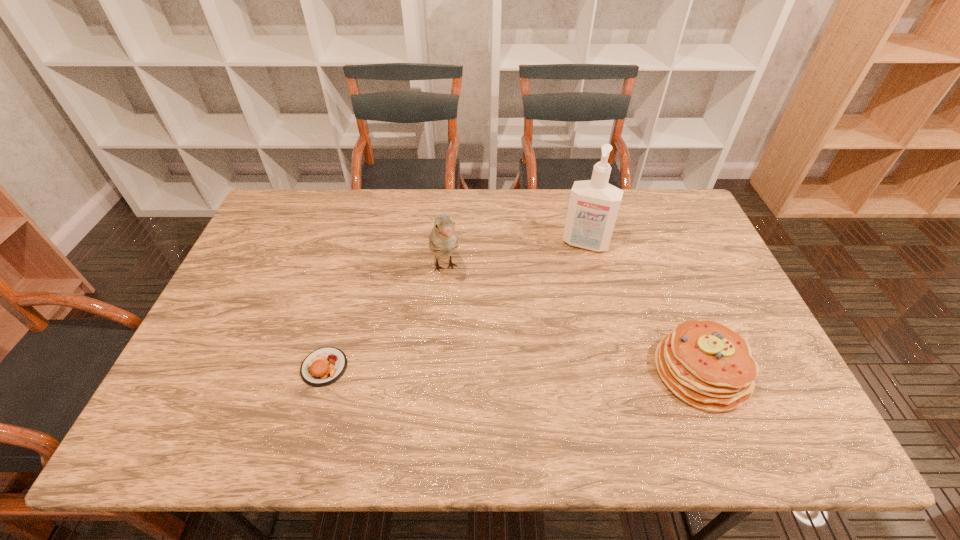
The width and height of the screenshot is (960, 540). Identify the location of free point between the rightmost object and the second tallest object. (573, 320).

Identify the location of vacant area between the rightmost object and the third shortest object. Image resolution: width=960 pixels, height=540 pixels. (573, 320).

I want to click on vacant point located between the third object from right to left and the third object from left to right, so click(516, 255).

Identify the location of empty space between the patty (food) and the third shortest object. (385, 318).

Find the location of `free point between the cleansing agent and the pancake`. free point between the cleansing agent and the pancake is located at coordinates (x=643, y=307).

Select which object is the second closest to the third object from right to left. Please provide its 2D coordinates. Your answer should be formatted as a tuple, i.e. [(x, y)], where the tuple contains the x and y coordinates of a point satisfying the conditions above.

[(593, 207)]

Select which object appears as the third closest to the tallest object. Please provide its 2D coordinates. Your answer should be formatted as a tuple, i.e. [(x, y)], where the tuple contains the x and y coordinates of a point satisfying the conditions above.

[(324, 366)]

Identify the location of vacant region that satisfies the following two spatial constraints: 1. on the back side of the shortest object; 2. on the right side of the third object from right to left. The height and width of the screenshot is (540, 960). (352, 268).

Find the location of a particular element. free location that satisfies the following two spatial constraints: 1. on the front side of the shortest object; 2. on the right side of the rightmost object is located at coordinates (324, 371).